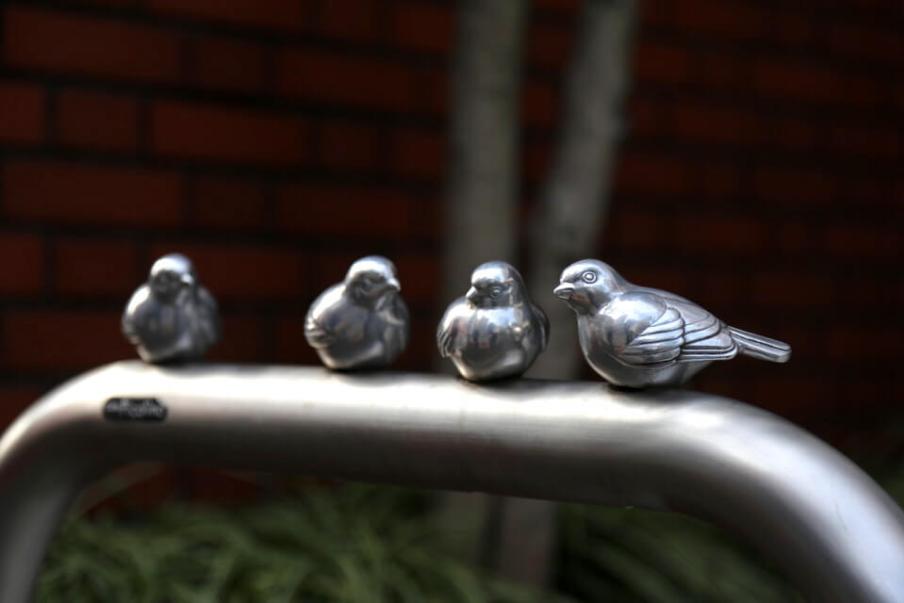
Find the location of `bar`. bar is located at coordinates (421, 438).